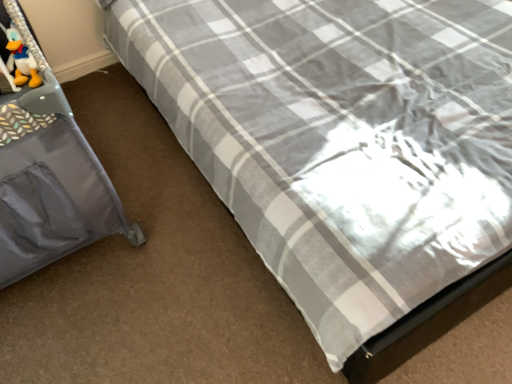
Describe the element at coordinates (22, 63) in the screenshot. I see `plush yellow duck at left` at that location.

Image resolution: width=512 pixels, height=384 pixels. What are the coordinates of `plush yellow duck at left` in the screenshot? It's located at pos(22,63).

You are a GUI agent. You are given a task and a screenshot of the screen. Output one action in this format:
    pyautogui.click(x=<x>, y=<y>)
    Task: Click on the plush yellow duck at left
    The height and width of the screenshot is (384, 512).
    Given the screenshot: What is the action you would take?
    pyautogui.click(x=22, y=63)